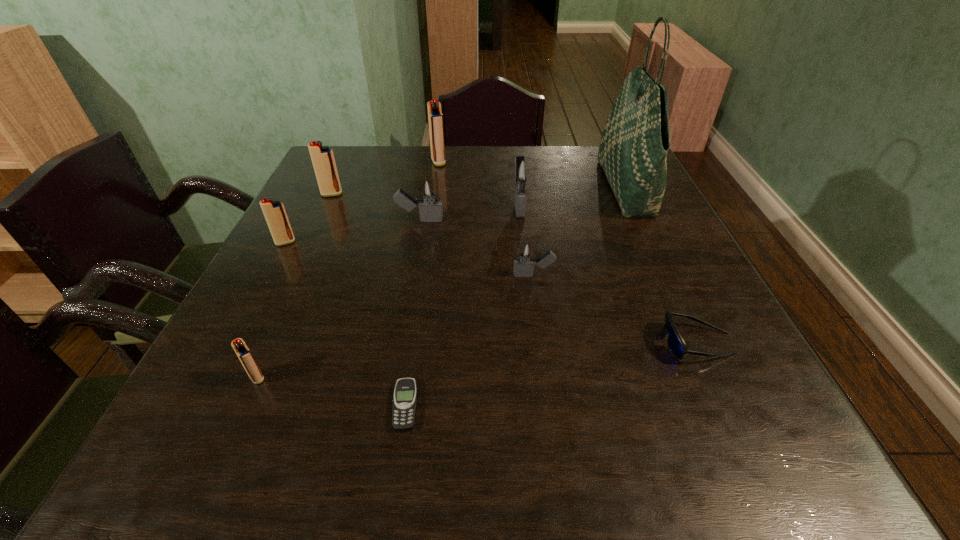
Identify the location of igniter at the far edge. The image size is (960, 540). (435, 117).

Find the location of a particular element. This screenshot has height=540, width=960. object present at the near edge is located at coordinates (404, 403).

This screenshot has width=960, height=540. I want to click on tote bag that is positioned at the right edge, so click(634, 144).

The image size is (960, 540). What are the coordinates of `sunglasses that is at the right edge` in the screenshot? It's located at (675, 342).

Locate an element on the screen. object present at the far right corner is located at coordinates (634, 144).

Locate an element on the screen. blank space at the far edge is located at coordinates (517, 150).

The width and height of the screenshot is (960, 540). Identify the location of blank space at the near edge of the desktop. (684, 438).

Identify the location of vacant area at the left edge. The height and width of the screenshot is (540, 960). (351, 225).

Image resolution: width=960 pixels, height=540 pixels. Identify the location of vacant space at the right edge of the desktop. (704, 367).

Image resolution: width=960 pixels, height=540 pixels. Identify the location of free space at the far right corner of the desktop. (594, 166).